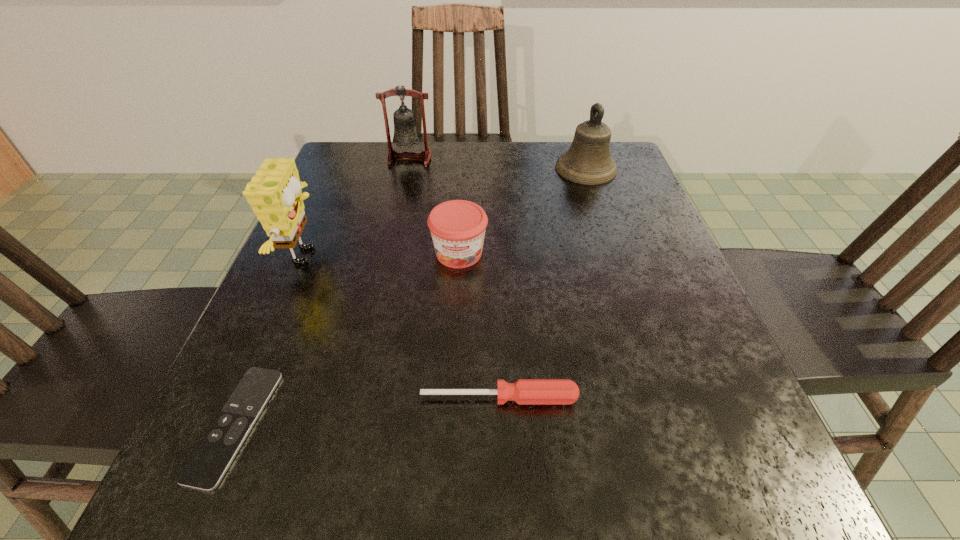
Where is `free location located 0.140m on the right of the fifth tallest object`? The image size is (960, 540). free location located 0.140m on the right of the fifth tallest object is located at coordinates pyautogui.click(x=676, y=398).

This screenshot has height=540, width=960. I want to click on free space located 0.260m on the back of the remote control, so click(x=307, y=256).

Where is `object that is at the near edge`? The height and width of the screenshot is (540, 960). object that is at the near edge is located at coordinates (205, 468).

This screenshot has height=540, width=960. In order to click on bell located at the left edge in this screenshot , I will do `click(406, 134)`.

Where is `sponge that is positioned at the left edge`? The width and height of the screenshot is (960, 540). sponge that is positioned at the left edge is located at coordinates (274, 193).

Locate an element on the screen. The width and height of the screenshot is (960, 540). remote control present at the left edge is located at coordinates (205, 468).

You are a GUI agent. You are given a task and a screenshot of the screen. Output one action in this format:
    pyautogui.click(x=<x>, y=<y>)
    Task: Click on the object that is at the right edge
    This screenshot has height=540, width=960.
    Given the screenshot: What is the action you would take?
    pyautogui.click(x=588, y=161)

Locate an element on the screen. object that is at the far left corner is located at coordinates (406, 134).

I want to click on object located at the near left corner, so click(205, 468).

Where is `object located at the far right corner`? The image size is (960, 540). object located at the far right corner is located at coordinates (588, 161).